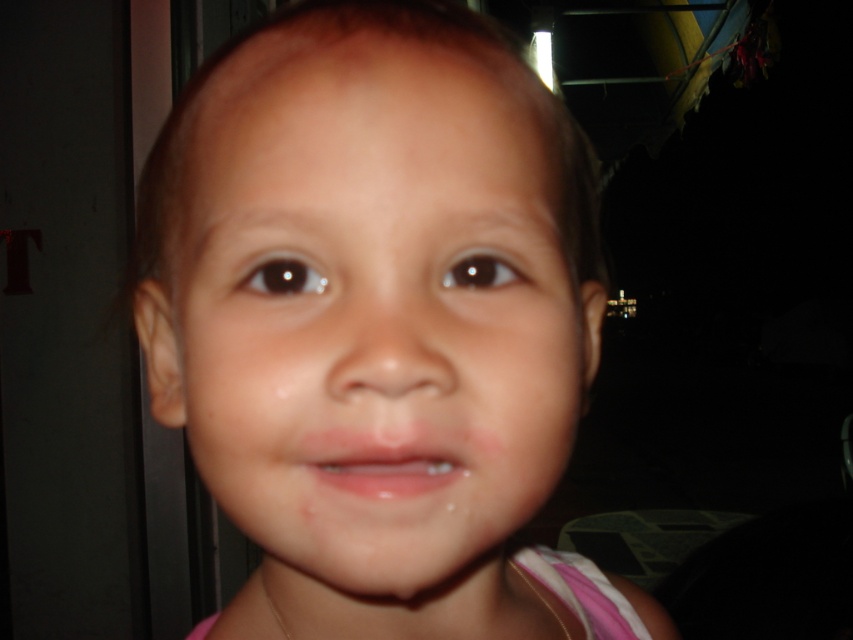
Can you confirm if smooth skin face at center is bigger than glossy pink lips at center?

Yes, smooth skin face at center is bigger than glossy pink lips at center.

Who is higher up, smooth skin face at center or glossy pink lips at center?

smooth skin face at center is higher up.

Is point (341, 310) positioned behind point (404, 493)?

That is True.

You are a GUI agent. You are given a task and a screenshot of the screen. Output one action in this format:
    pyautogui.click(x=<x>, y=<y>)
    Task: Click on the smooth skin face at center
    
    Given the screenshot: What is the action you would take?
    pyautogui.click(x=376, y=321)